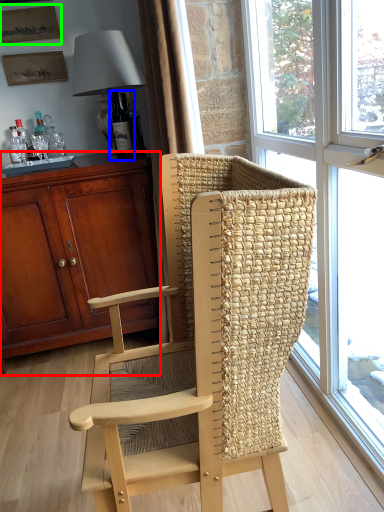
Question: Which object is positioned closest to cabinetry (highlighted by a red box)? Select from bottle (highlighted by a blue box) and picture frame (highlighted by a green box).

Choices:
 (A) bottle
 (B) picture frame

Answer: (A)